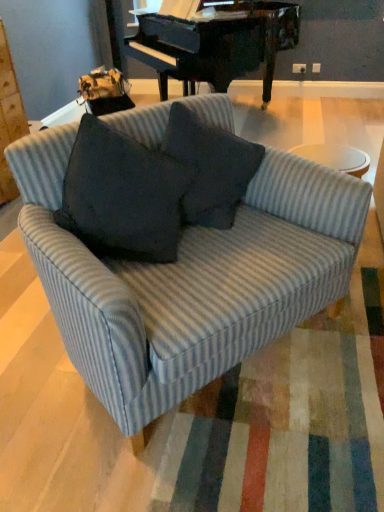
This screenshot has width=384, height=512. What do you see at coordinates (210, 167) in the screenshot?
I see `gray corduroy throw pillow at center` at bounding box center [210, 167].

Image resolution: width=384 pixels, height=512 pixels. In order to click on gray corduroy throw pillow at center in this screenshot , I will do `click(210, 167)`.

Describe the element at coordinates (189, 278) in the screenshot. This screenshot has width=384, height=512. I see `striped fabric couch at center` at that location.

What is the approximate width of striped fabric couch at center?

striped fabric couch at center is 34.60 inches in width.

Locate an element on the screen. This screenshot has height=512, width=384. striped fabric couch at center is located at coordinates (189, 278).

Where is `gray corduroy throw pillow at center`? gray corduroy throw pillow at center is located at coordinates (210, 167).

Is striped fabric couch at center at the right side of gray corduroy throw pillow at center?

No, striped fabric couch at center is not to the right of gray corduroy throw pillow at center.

Considering the relative positions of striped fabric couch at center and gray corduroy throw pillow at center in the image provided, is striped fabric couch at center behind gray corduroy throw pillow at center?

No.

Which is in front, point (51, 269) or point (211, 134)?

Point (51, 269)

From the image's perspective, which is above, striped fabric couch at center or gray corduroy throw pillow at center?

From the image's view, gray corduroy throw pillow at center is above.

From a real-world perspective, between striped fabric couch at center and gray corduroy throw pillow at center, who is vertically lower?

striped fabric couch at center is physically lower.

Looking at their sizes, would you say striped fabric couch at center is wider or thinner than gray corduroy throw pillow at center?

Clearly, striped fabric couch at center has more width compared to gray corduroy throw pillow at center.

Is striped fabric couch at center shorter than gray corduroy throw pillow at center?

No.

Based on the photo, looking at the image, does striped fabric couch at center seem bigger or smaller compared to gray corduroy throw pillow at center?

Considering their sizes, striped fabric couch at center takes up more space than gray corduroy throw pillow at center.

Is striped fabric couch at center positioned beyond the bounds of gray corduroy throw pillow at center?

striped fabric couch at center lies outside gray corduroy throw pillow at center's area.

Would you say striped fabric couch at center is a long distance from gray corduroy throw pillow at center?

striped fabric couch at center is actually quite close to gray corduroy throw pillow at center.

Is striped fabric couch at center facing towards gray corduroy throw pillow at center?

Yes.

In the image, there is a gray corduroy throw pillow at center. Where is `studio couch below it (from the image's perspective)`? This screenshot has width=384, height=512. studio couch below it (from the image's perspective) is located at coordinates (189, 278).

Can you confirm if gray corduroy throw pillow at center is positioned to the left of striped fabric couch at center?

No.

Is gray corduroy throw pillow at center further to camera compared to striped fabric couch at center?

That is True.

Is point (255, 144) positioned before point (36, 236)?

No, (255, 144) is behind (36, 236).

From the image's perspective, would you say gray corduroy throw pillow at center is shown under striped fabric couch at center?

Incorrect, from the image's perspective, gray corduroy throw pillow at center is higher than striped fabric couch at center.

From a real-world perspective, which is physically above, gray corduroy throw pillow at center or striped fabric couch at center?

gray corduroy throw pillow at center is physically above.

Does gray corduroy throw pillow at center have a lesser width compared to striped fabric couch at center?

Yes.

Can you confirm if gray corduroy throw pillow at center is taller than striped fabric couch at center?

No, gray corduroy throw pillow at center is not taller than striped fabric couch at center.

Can you confirm if gray corduroy throw pillow at center is bigger than striped fabric couch at center?

Actually, gray corduroy throw pillow at center might be smaller than striped fabric couch at center.

Would you say gray corduroy throw pillow at center is outside striped fabric couch at center?

That's incorrect, gray corduroy throw pillow at center is not completely outside striped fabric couch at center.

Is gray corduroy throw pillow at center next to striped fabric couch at center and touching it?

There is a gap between gray corduroy throw pillow at center and striped fabric couch at center.

Is gray corduroy throw pillow at center facing towards striped fabric couch at center?

Yes, gray corduroy throw pillow at center is aimed at striped fabric couch at center.

Measure the distance between gray corduroy throw pillow at center and striped fabric couch at center.

gray corduroy throw pillow at center and striped fabric couch at center are 28.89 centimeters apart.

Identify the location of studio couch that is on the left side of gray corduroy throw pillow at center. (189, 278).

Locate an element on the screen. studio couch in front of the gray corduroy throw pillow at center is located at coordinates (189, 278).

Locate an element on the screen. This screenshot has height=512, width=384. studio couch located on the left of gray corduroy throw pillow at center is located at coordinates [x=189, y=278].